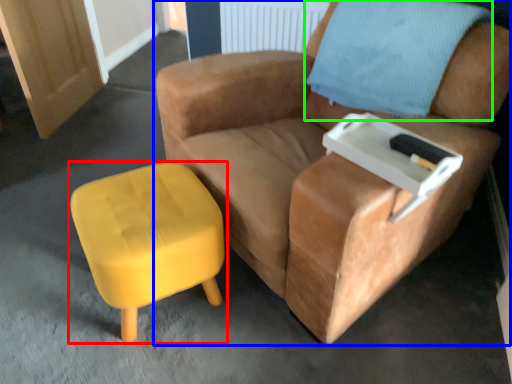
Question: Which object is positioned farthest from stool (highlighted by a red box)? Select from chair (highlighted by a blue box) and pillow (highlighted by a green box).

Choices:
 (A) chair
 (B) pillow

Answer: (B)